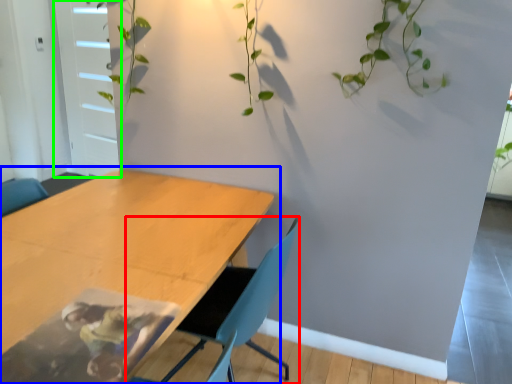
Question: Which object is positioned farthest from chair (highlighted by a red box)? Select from table (highlighted by a blue box) and glass door (highlighted by a green box).

Choices:
 (A) table
 (B) glass door

Answer: (B)